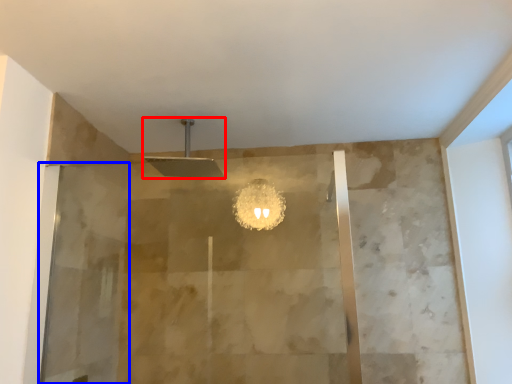
Question: Which of the following is the farthest to the observer, shower (highlighted by a red box) or screen door (highlighted by a blue box)?

Choices:
 (A) shower
 (B) screen door

Answer: (A)